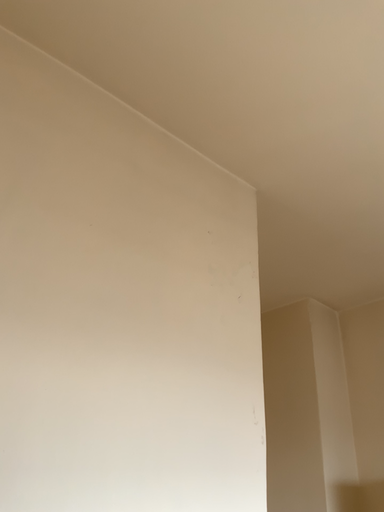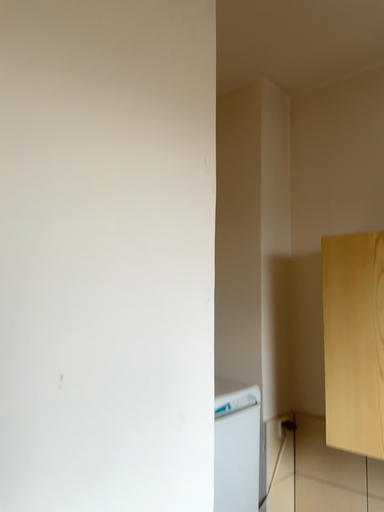
Question: How did the camera likely rotate when shooting the video?

Choices:
 (A) rotated downward
 (B) rotated upward

Answer: (A)